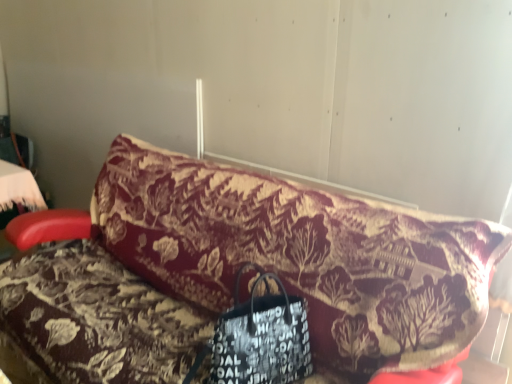
Question: From a real-world perspective, is velvet floral-patterned couch at center above or below black leather handbag at center?

Choices:
 (A) above
 (B) below

Answer: (B)

Question: Considering the positions of velvet floral-patterned couch at center and black leather handbag at center in the image, is velvet floral-patterned couch at center wider or thinner than black leather handbag at center?

Choices:
 (A) thin
 (B) wide

Answer: (B)

Question: Considering their positions, is velvet floral-patterned couch at center located in front of or behind black leather handbag at center?

Choices:
 (A) behind
 (B) front

Answer: (B)

Question: Is black leather handbag at center in front of or behind velvet floral-patterned couch at center in the image?

Choices:
 (A) behind
 (B) front

Answer: (A)

Question: Does point (186, 374) appear closer or farther from the camera than point (243, 289)?

Choices:
 (A) farther
 (B) closer

Answer: (B)

Question: From the image's perspective, is black leather handbag at center positioned above or below velvet floral-patterned couch at center?

Choices:
 (A) below
 (B) above

Answer: (A)

Question: Considering the relative positions of black leather handbag at center and velvet floral-patterned couch at center in the image provided, is black leather handbag at center to the left or to the right of velvet floral-patterned couch at center?

Choices:
 (A) right
 (B) left

Answer: (A)